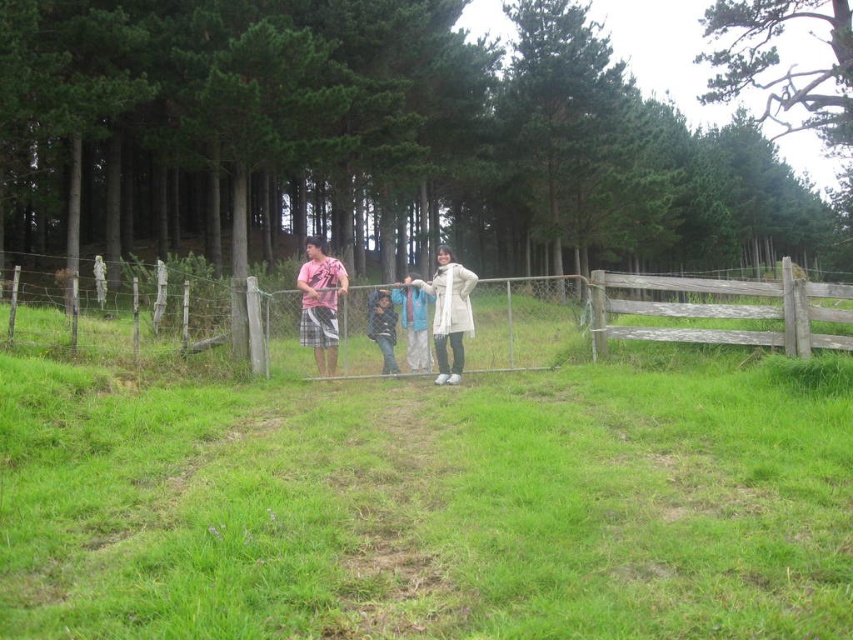
What do you see at coordinates (606, 316) in the screenshot? The width and height of the screenshot is (853, 640). I see `wooden gate at center` at bounding box center [606, 316].

Is wooden gate at center below matte pink shirt at center?

Incorrect, wooden gate at center is not positioned below matte pink shirt at center.

Does point (496, 300) come behind point (339, 291)?

Yes, it is behind point (339, 291).

This screenshot has height=640, width=853. Identify the location of wooden gate at center. (606, 316).

Which is behind, point (346, 284) or point (309, 323)?

The point (309, 323) is more distant.

Between matte pink shirt at center and pink cotton shirt at center, which one has more height?

matte pink shirt at center is taller.

Is point (387, 332) more distant than point (325, 253)?

That is False.

Where is `matte pink shirt at center`? This screenshot has height=640, width=853. matte pink shirt at center is located at coordinates (321, 284).

Between wooden gate at center and dark blue denim jeans at center, which one appears on the left side from the viewer's perspective?

wooden gate at center

Does wooden gate at center have a smaller size compared to dark blue denim jeans at center?

No.

Which is behind, point (775, 337) or point (376, 310)?

The point (376, 310) is more distant.

Locate an element on the screen. This screenshot has width=853, height=640. wooden gate at center is located at coordinates (606, 316).